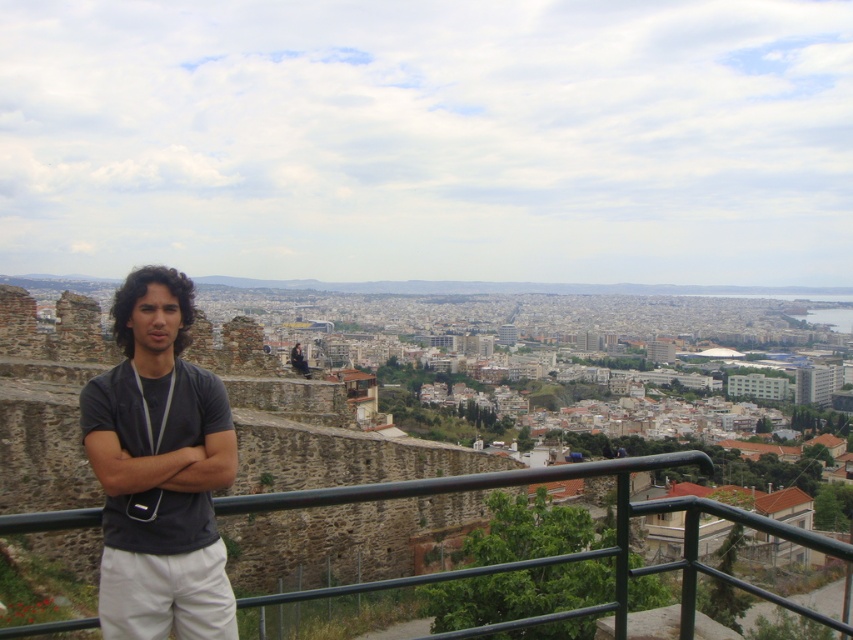
Question: Among these points, which one is nearest to the camera?

Choices:
 (A) (296, 340)
 (B) (128, 561)
 (C) (554, 476)

Answer: (B)

Question: In this image, where is dark gray t-shirt at center located relative to metal/rustic rail at center?

Choices:
 (A) below
 (B) above

Answer: (B)

Question: Does dark gray t-shirt at center appear on the left side of metal/rustic rail at center?

Choices:
 (A) yes
 (B) no

Answer: (A)

Question: Does dark gray t-shirt at center have a larger size compared to metal/rustic rail at center?

Choices:
 (A) yes
 (B) no

Answer: (B)

Question: Among these points, which one is farthest from the camera?

Choices:
 (A) (283, 506)
 (B) (294, 346)

Answer: (B)

Question: Which is farther from the dark gray t-shirt at center?

Choices:
 (A) matte black shirt at center
 (B) metal/rustic rail at center

Answer: (A)